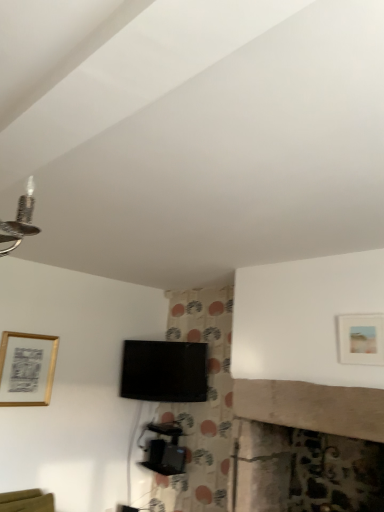
The image size is (384, 512). What do you see at coordinates (27, 369) in the screenshot? I see `gold metallic picture frame at upper left, which is the second picture frame in right-to-left order` at bounding box center [27, 369].

Where is `gold metallic picture frame at upper left, arranged as the first picture frame when viewed from the back`? This screenshot has width=384, height=512. gold metallic picture frame at upper left, arranged as the first picture frame when viewed from the back is located at coordinates (27, 369).

Measure the distance between point (x=362, y=356) and camera.

The distance of point (x=362, y=356) from camera is 2.44 meters.

You are a GUI agent. You are given a task and a screenshot of the screen. Output one action in this format:
    pyautogui.click(x=<x>, y=<y>)
    Task: Click on the black plastic tv stand at center
    This screenshot has width=384, height=512.
    Given the screenshot: What is the action you would take?
    pyautogui.click(x=164, y=449)

The height and width of the screenshot is (512, 384). Describe the element at coordinates (164, 371) in the screenshot. I see `black glossy tv at center` at that location.

Where is `gold metallic picture frame at upper left, the 2th picture frame in the top-to-bottom sequence`? This screenshot has height=512, width=384. gold metallic picture frame at upper left, the 2th picture frame in the top-to-bottom sequence is located at coordinates (27, 369).

Looking at this image, considering their positions, is black plastic tv stand at center located in front of or behind black glossy tv at center?

In the image, black plastic tv stand at center appears in front of black glossy tv at center.

Which is closer, (171, 422) or (148, 400)?

Point (171, 422) is positioned farther from the camera compared to point (148, 400).

Which object is thinner, black plastic tv stand at center or black glossy tv at center?

black glossy tv at center.

Consider the image. Is black glossy tv at center located within black plastic tv stand at center?

No, black glossy tv at center is not a part of black plastic tv stand at center.

Is gold metallic picture frame at upper left, arranged as the first picture frame when viewed from the back, inside or outside of black glossy tv at center?

gold metallic picture frame at upper left, arranged as the first picture frame when viewed from the back, is located beyond the bounds of black glossy tv at center.

Can you confirm if gold metallic picture frame at upper left, placed as the first picture frame when sorted from bottom to top, is taller than black glossy tv at center?

Correct, gold metallic picture frame at upper left, placed as the first picture frame when sorted from bottom to top, is much taller as black glossy tv at center.

From a real-world perspective, is gold metallic picture frame at upper left, the 2th picture frame in the top-to-bottom sequence, positioned above or below black glossy tv at center?

Clearly, from a real-world perspective, gold metallic picture frame at upper left, the 2th picture frame in the top-to-bottom sequence, is below black glossy tv at center.

Which of these two, gold metallic picture frame at upper left, the 2th picture frame in the top-to-bottom sequence, or black glossy tv at center, is thinner?

Thinner between the two is gold metallic picture frame at upper left, the 2th picture frame in the top-to-bottom sequence.

Is gold metallic picture frame at upper left, which is the second picture frame in right-to-left order, inside black glossy tv at center?

No, gold metallic picture frame at upper left, which is the second picture frame in right-to-left order, is not surrounded by black glossy tv at center.

Is black glossy tv at center positioned in front of gold metallic picture frame at upper left, the 2th picture frame in the top-to-bottom sequence?

No.

Which is behind, point (156, 395) or point (1, 373)?

The point (156, 395) is more distant.

Between black glossy tv at center and gold metallic picture frame at upper left, arranged as the first picture frame when viewed from the back, which one has larger size?

With larger size is black glossy tv at center.

Which object is closer to the camera taking this photo, black glossy tv at center or black plastic tv stand at center?

black plastic tv stand at center is in front.

Considering the relative sizes of black glossy tv at center and black plastic tv stand at center in the image provided, is black glossy tv at center wider than black plastic tv stand at center?

Incorrect, the width of black glossy tv at center does not surpass that of black plastic tv stand at center.

Find the location of a particular element. This screenshot has height=512, width=384. television on the right of black plastic tv stand at center is located at coordinates (164, 371).

Is black glossy tv at center oriented towards black plastic tv stand at center?

No, black glossy tv at center is not facing towards black plastic tv stand at center.

Which of these two, gold metallic picture frame at upper left, placed as the first picture frame when sorted from bottom to top, or black plastic tv stand at center, is bigger?

black plastic tv stand at center.

Are gold metallic picture frame at upper left, marked as the 1th picture frame in a left-to-right arrangement, and black plastic tv stand at center making contact?

No, gold metallic picture frame at upper left, marked as the 1th picture frame in a left-to-right arrangement, is not beside black plastic tv stand at center.

Is gold metallic picture frame at upper left, the second picture frame in the front-to-back sequence, looking in the opposite direction of black plastic tv stand at center?

No.

Can you tell me how much matte gold picture frame at upper right, which appears as the 2th picture frame when viewed from the back, and black glossy tv at center differ in facing direction?

39.5 degrees.

Is the position of matte gold picture frame at upper right, positioned as the 1th picture frame in right-to-left order, more distant than that of black glossy tv at center?

That is False.

Which of these two, matte gold picture frame at upper right, positioned as the 1th picture frame in right-to-left order, or black glossy tv at center, is wider?

black glossy tv at center is wider.

Does matte gold picture frame at upper right, positioned as the 1th picture frame in right-to-left order, have a lesser height compared to gold metallic picture frame at upper left, marked as the 1th picture frame in a left-to-right arrangement?

Yes, matte gold picture frame at upper right, positioned as the 1th picture frame in right-to-left order, is shorter than gold metallic picture frame at upper left, marked as the 1th picture frame in a left-to-right arrangement.

Considering the relative positions of matte gold picture frame at upper right, marked as the 1th picture frame in a top-to-bottom arrangement, and gold metallic picture frame at upper left, which is the second picture frame in right-to-left order, in the image provided, is matte gold picture frame at upper right, marked as the 1th picture frame in a top-to-bottom arrangement, in front of gold metallic picture frame at upper left, which is the second picture frame in right-to-left order,?

Yes, matte gold picture frame at upper right, marked as the 1th picture frame in a top-to-bottom arrangement, is closer to the camera.

Which of these two, matte gold picture frame at upper right, which appears as the first picture frame when viewed from the front, or gold metallic picture frame at upper left, placed as the first picture frame when sorted from bottom to top, is thinner?

With smaller width is gold metallic picture frame at upper left, placed as the first picture frame when sorted from bottom to top.

Does matte gold picture frame at upper right, acting as the 2th picture frame starting from the bottom, have a smaller size compared to gold metallic picture frame at upper left, the 2th picture frame in the top-to-bottom sequence?

Yes.

The height and width of the screenshot is (512, 384). What are the coordinates of `television above the black plastic tv stand at center (from the image's perspective)` in the screenshot? It's located at (164, 371).

I want to click on picture frame beneath the black glossy tv at center (from a real-world perspective), so click(27, 369).

Estimate the real-world distances between objects in this image. Which object is further from black plastic tv stand at center, black glossy tv at center or gold metallic picture frame at upper left, the 2th picture frame in the top-to-bottom sequence?

The object further to black plastic tv stand at center is gold metallic picture frame at upper left, the 2th picture frame in the top-to-bottom sequence.

Estimate the real-world distances between objects in this image. Which object is closer to matte gold picture frame at upper right, positioned as the 1th picture frame in right-to-left order, black glossy tv at center or black plastic tv stand at center?

Based on the image, black glossy tv at center appears to be nearer to matte gold picture frame at upper right, positioned as the 1th picture frame in right-to-left order.

When comparing their distances from black glossy tv at center, does black plastic tv stand at center or matte gold picture frame at upper right, marked as the 2th picture frame in a left-to-right arrangement, seem further?

matte gold picture frame at upper right, marked as the 2th picture frame in a left-to-right arrangement.

When comparing their distances from black glossy tv at center, does matte gold picture frame at upper right, which appears as the first picture frame when viewed from the front, or gold metallic picture frame at upper left, the second picture frame in the front-to-back sequence, seem further?

matte gold picture frame at upper right, which appears as the first picture frame when viewed from the front, is positioned further to the anchor black glossy tv at center.

Looking at the image, which one is located further to black glossy tv at center, gold metallic picture frame at upper left, the 2th picture frame in the top-to-bottom sequence, or matte gold picture frame at upper right, acting as the 2th picture frame starting from the bottom?

Among the two, matte gold picture frame at upper right, acting as the 2th picture frame starting from the bottom, is located further to black glossy tv at center.

Considering their positions, is gold metallic picture frame at upper left, the second picture frame in the front-to-back sequence, positioned further to black plastic tv stand at center than matte gold picture frame at upper right, positioned as the 1th picture frame in right-to-left order?

matte gold picture frame at upper right, positioned as the 1th picture frame in right-to-left order, is further to black plastic tv stand at center.

Which object lies nearer to the anchor point black plastic tv stand at center, gold metallic picture frame at upper left, marked as the 1th picture frame in a left-to-right arrangement, or black glossy tv at center?

black glossy tv at center.

Considering their positions, is black plastic tv stand at center positioned further to matte gold picture frame at upper right, which appears as the first picture frame when viewed from the front, than black glossy tv at center?

The object further to matte gold picture frame at upper right, which appears as the first picture frame when viewed from the front, is black plastic tv stand at center.

The width and height of the screenshot is (384, 512). What are the coordinates of `furniture situated between gold metallic picture frame at upper left, arranged as the first picture frame when viewed from the back, and black glossy tv at center from left to right` in the screenshot? It's located at (164, 449).

What are the coordinates of `furniture located between matte gold picture frame at upper right, marked as the 1th picture frame in a top-to-bottom arrangement, and black glossy tv at center in the depth direction` in the screenshot? It's located at (164, 449).

At what (x,y) coordinates should I click in order to perform the action: click on television between gold metallic picture frame at upper left, placed as the first picture frame when sorted from bottom to top, and matte gold picture frame at upper right, marked as the 2th picture frame in a left-to-right arrangement, from left to right. Please return your answer as a coordinate pair (x, y). The image size is (384, 512). Looking at the image, I should click on (164, 371).

Locate an element on the screen. The image size is (384, 512). furniture situated between gold metallic picture frame at upper left, marked as the 1th picture frame in a left-to-right arrangement, and matte gold picture frame at upper right, marked as the 1th picture frame in a top-to-bottom arrangement, from left to right is located at coordinates (164, 449).